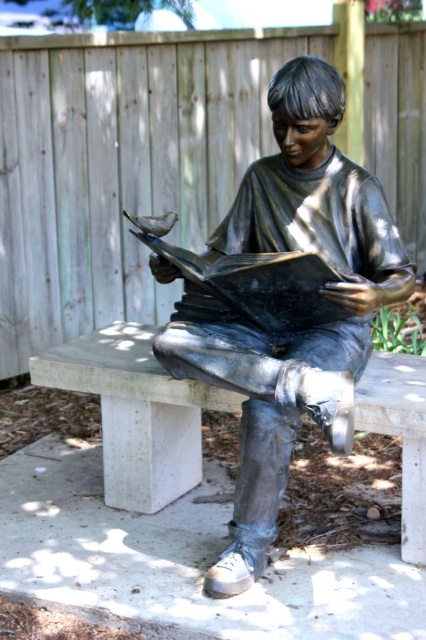
Who is positioned more to the right, shiny bronze statue at center or concrete bench at center?

From the viewer's perspective, shiny bronze statue at center appears more on the right side.

Is shiny bronze statue at center shorter than concrete bench at center?

No, shiny bronze statue at center is not shorter than concrete bench at center.

Who is more distant from viewer, (344,104) or (143,355)?

The point (143,355) is behind.

I want to click on shiny bronze statue at center, so click(284, 301).